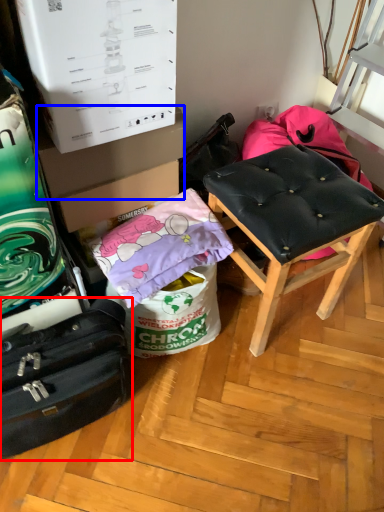
Question: Which of the following is the farthest to the observer, suitcase (highlighted by a red box) or cardboard box (highlighted by a blue box)?

Choices:
 (A) suitcase
 (B) cardboard box

Answer: (B)